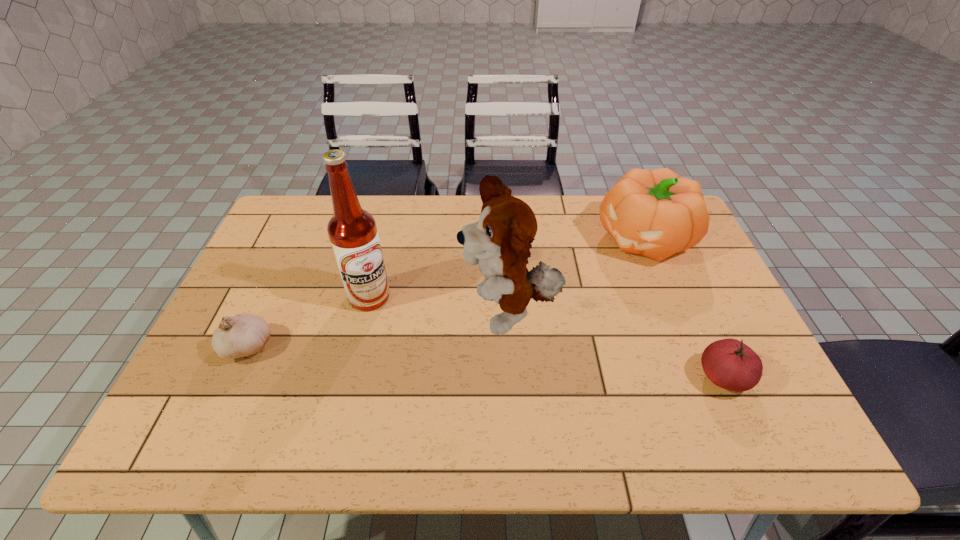
Locate an element on the screen. This screenshot has height=540, width=960. vacant space located 0.100m on the face of the puppy is located at coordinates (430, 349).

Where is `free point located on the face of the puppy`? The width and height of the screenshot is (960, 540). free point located on the face of the puppy is located at coordinates (416, 356).

Find the location of a particular element. This screenshot has width=960, height=540. free space located on the carved face of the farthest object is located at coordinates (526, 324).

Where is `free region located 0.300m on the carved face of the farthest object`? This screenshot has width=960, height=540. free region located 0.300m on the carved face of the farthest object is located at coordinates (547, 309).

The image size is (960, 540). In order to click on free region located 0.360m on the carved face of the farthest object in this screenshot , I will do (x=532, y=320).

Find the location of a particular element. free spot located on the label side of the second object from left to right is located at coordinates (502, 379).

Locate an element on the screen. vacant position located on the label side of the second object from left to right is located at coordinates (429, 334).

What are the coordinates of `vacant point located on the label side of the second object from left to right` in the screenshot? It's located at (420, 328).

Locate an element on the screen. The width and height of the screenshot is (960, 540). object present at the far edge is located at coordinates (656, 213).

The width and height of the screenshot is (960, 540). I want to click on object located in the near edge section of the desktop, so click(x=729, y=363).